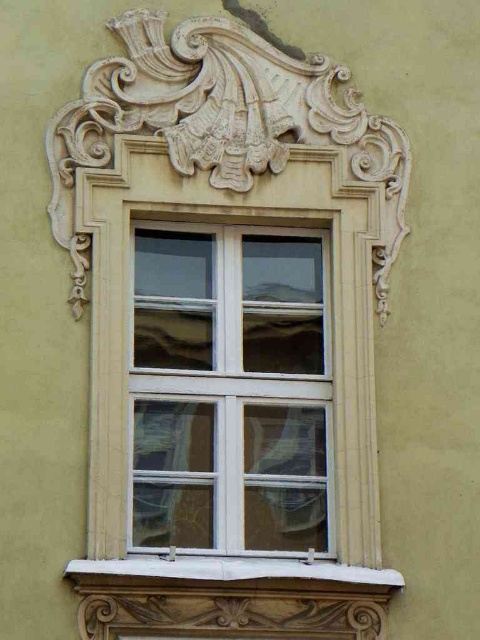
Question: Which of the following is the closest to the observer?

Choices:
 (A) clear glass window at center
 (B) white stone window sill at lower center

Answer: (B)

Question: Does clear glass window at center appear over white stone window sill at lower center?

Choices:
 (A) no
 (B) yes

Answer: (B)

Question: Is clear glass window at center bigger than white stone window sill at lower center?

Choices:
 (A) no
 (B) yes

Answer: (B)

Question: Is clear glass window at center positioned before white stone window sill at lower center?

Choices:
 (A) yes
 (B) no

Answer: (B)